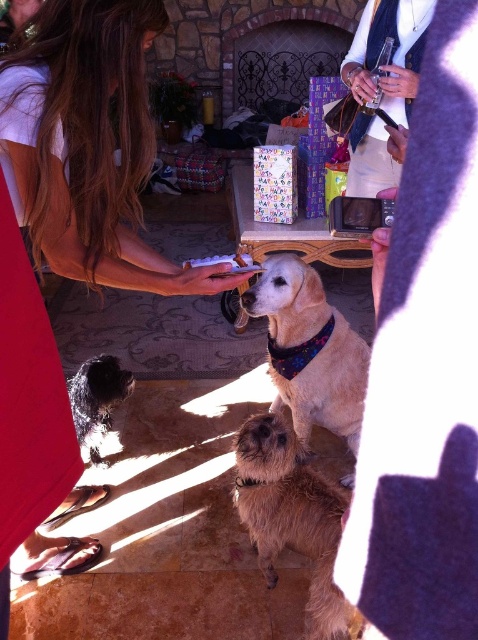
Question: Estimate the real-world distances between objects in this image. Which object is closer to the white paper at center?

Choices:
 (A) shaggy brown dog at center
 (B) golden fur dog at center

Answer: (B)

Question: Estimate the real-world distances between objects in this image. Which object is farther from the matte white shirt at center?

Choices:
 (A) white paper at center
 (B) golden fur dog at center

Answer: (B)

Question: Which point is closer to the camera taking this photo?

Choices:
 (A) (360, 353)
 (B) (98, 426)

Answer: (A)

Question: Can you confirm if black fuzzy dog at lower left is positioned to the left of white paper at center?

Choices:
 (A) yes
 (B) no

Answer: (A)

Question: Is golden fur dog at center to the right of white paper at center from the viewer's perspective?

Choices:
 (A) no
 (B) yes

Answer: (B)

Question: Is golden fur dog at center below white paper at center?

Choices:
 (A) no
 (B) yes

Answer: (B)